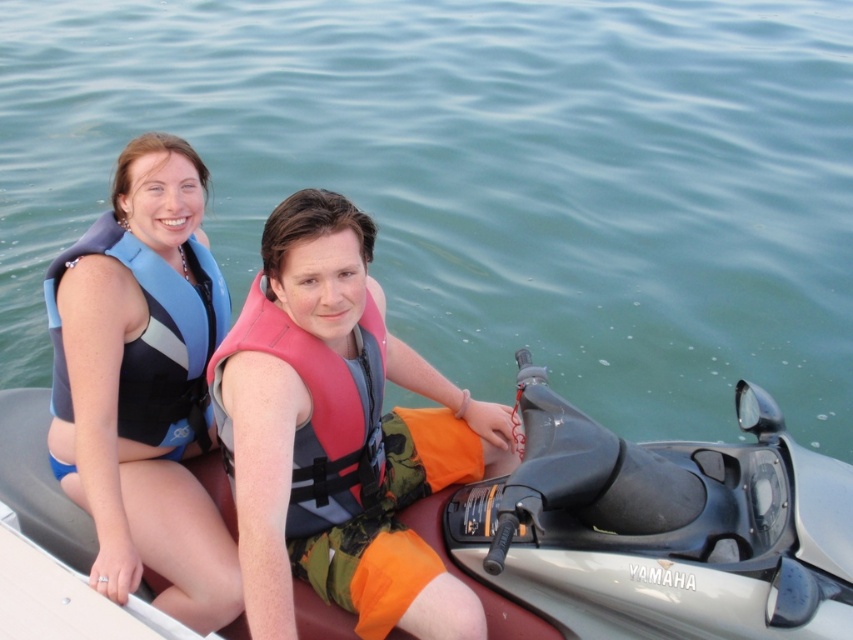
Question: Does metallic gray jet ski at center appear on the right side of blue fabric life jacket at left?

Choices:
 (A) no
 (B) yes

Answer: (B)

Question: Which point is closer to the camera?

Choices:
 (A) (444, 588)
 (B) (502, 368)

Answer: (A)

Question: Which point is farther from the camera taking this photo?

Choices:
 (A) (318, 502)
 (B) (433, 566)
 (C) (229, 580)

Answer: (A)

Question: Does pink fabric life jacket at center appear under blue fabric life jacket at left?

Choices:
 (A) no
 (B) yes

Answer: (B)

Question: Which object is farther from the camera taking this photo?

Choices:
 (A) matte blue life vest at left
 (B) pink fabric life jacket at center
 (C) blue fabric life jacket at left

Answer: (C)

Question: Can you confirm if matte blue life vest at left is bigger than blue neoprene life vest at upper left?

Choices:
 (A) no
 (B) yes

Answer: (B)